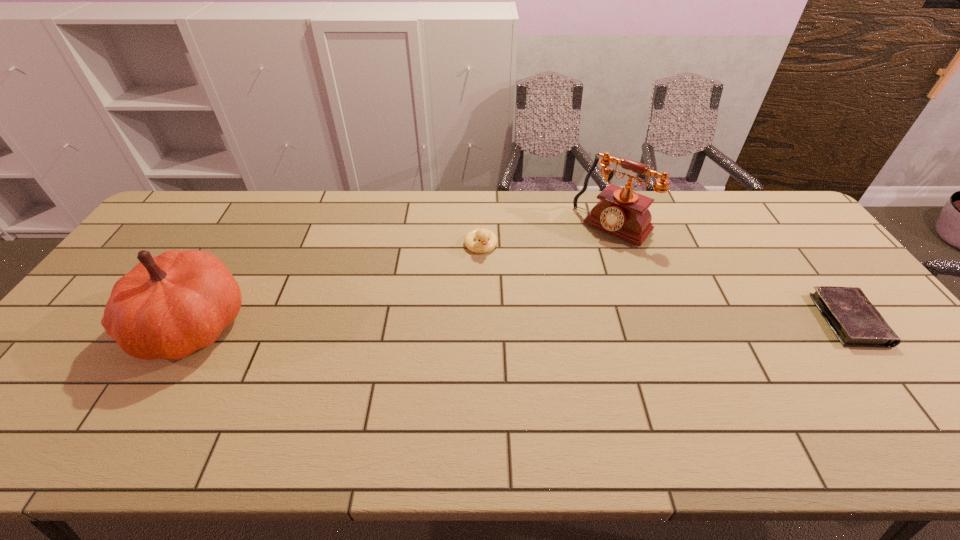
This screenshot has height=540, width=960. Find the location of `free point located on the dial of the telephone`. free point located on the dial of the telephone is located at coordinates (549, 295).

Image resolution: width=960 pixels, height=540 pixels. I want to click on vacant space located 0.250m on the dial of the telephone, so click(555, 289).

This screenshot has width=960, height=540. In order to click on vacant space located on the dial of the telephone in this screenshot , I will do `click(551, 293)`.

Locate an element on the screen. The height and width of the screenshot is (540, 960). vacant area situated 0.220m at the beak of the second shortest object is located at coordinates (499, 312).

Locate an element on the screen. The height and width of the screenshot is (540, 960). free region located at the beak of the second shortest object is located at coordinates (495, 299).

You are a GUI agent. You are given a task and a screenshot of the screen. Output one action in this format:
    pyautogui.click(x=<x>, y=<y>)
    Task: Click on the free space located at the beak of the second shortest object
    
    Given the screenshot: What is the action you would take?
    pyautogui.click(x=489, y=274)

I want to click on telephone at the far edge, so click(x=622, y=212).

Where is `duckling positioned at the far edge`? The image size is (960, 540). duckling positioned at the far edge is located at coordinates (487, 240).

The height and width of the screenshot is (540, 960). In order to click on object that is at the near edge in this screenshot , I will do (x=167, y=307).

The width and height of the screenshot is (960, 540). I want to click on object located at the left edge, so click(x=167, y=307).